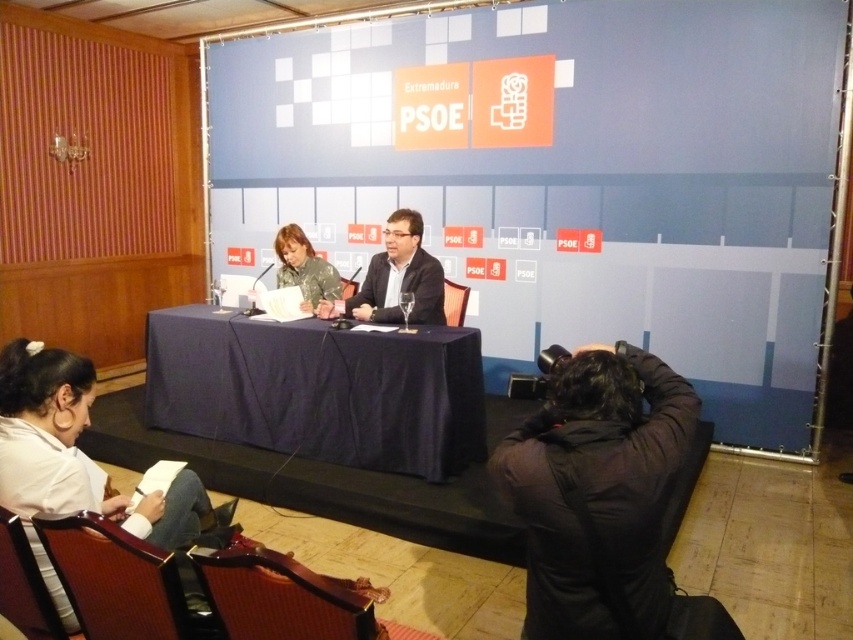
Question: Which point is farther to the camera?

Choices:
 (A) (305, 262)
 (B) (375, 276)
 (C) (57, 360)
 (D) (392, 467)

Answer: (A)

Question: Does dark blue fabric table at center appear over camouflage-patterned shirt at center?

Choices:
 (A) yes
 (B) no

Answer: (B)

Question: Is camouflage-patterned shirt at center behind camouflage fabric shirt at center?

Choices:
 (A) yes
 (B) no

Answer: (B)

Question: Does white fabric shirt at lower left appear over camouflage fabric shirt at center?

Choices:
 (A) yes
 (B) no

Answer: (B)

Question: Which point appears closest to the camera in this image?

Choices:
 (A) (357, 394)
 (B) (276, 244)
 (C) (59, 403)
 (D) (393, 250)

Answer: (C)

Question: Which point is closer to the camera?

Choices:
 (A) camouflage fabric shirt at center
 (B) dark blue fabric table at center
 (C) white fabric shirt at lower left
 (D) camouflage-patterned shirt at center

Answer: (C)